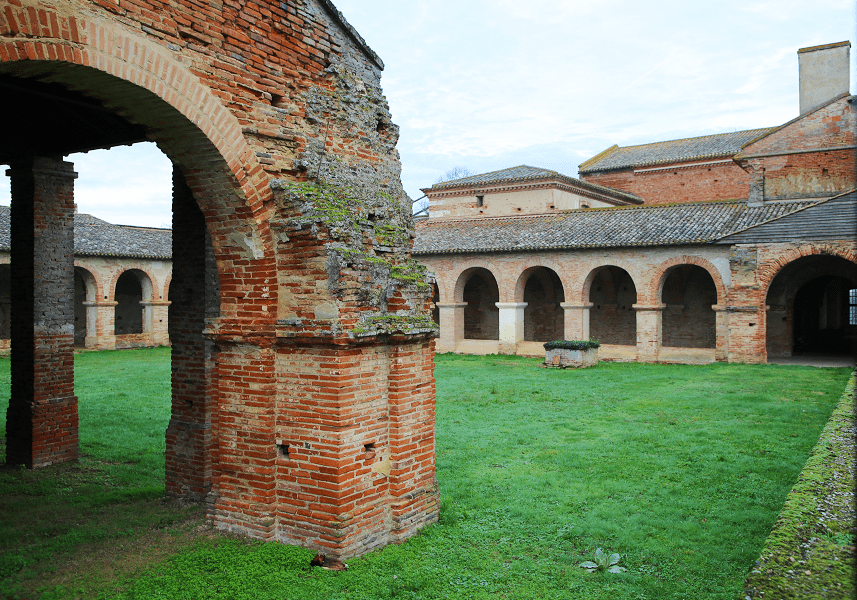
Identify the location of arch doorways/window. The height and width of the screenshot is (600, 857). (4, 285), (82, 290), (126, 297), (697, 319), (614, 328), (548, 317), (482, 326).